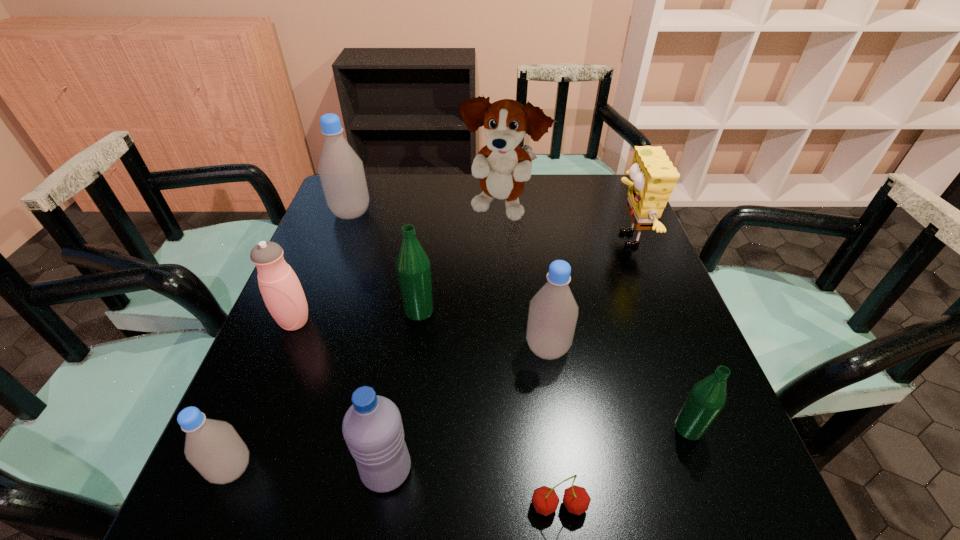
Where is `brown puppy`? The width and height of the screenshot is (960, 540). brown puppy is located at coordinates (502, 165).

This screenshot has width=960, height=540. What are the coordinates of `the farthest bottle` in the screenshot? It's located at (341, 171).

The height and width of the screenshot is (540, 960). I want to click on the farthest gray bottle, so click(341, 171).

Where is `yellow sponge`? Image resolution: width=960 pixels, height=540 pixels. yellow sponge is located at coordinates (652, 180).

At what (x,y) coordinates should I click in order to perform the action: click on the rightmost gray bottle. Please return your answer as a coordinate pair (x, y). The image size is (960, 540). Looking at the image, I should click on tap(553, 312).

The width and height of the screenshot is (960, 540). I want to click on the second farthest gray bottle, so click(x=553, y=312).

At what (x,y) coordinates should I click in order to perform the action: click on the farther green bottle. Please return your answer as a coordinate pair (x, y). Image resolution: width=960 pixels, height=540 pixels. Looking at the image, I should click on (413, 268).

This screenshot has width=960, height=540. In order to click on the left green bottle in this screenshot , I will do `click(413, 268)`.

The image size is (960, 540). I want to click on thermos bottle, so click(x=281, y=290).

At what (x,y) coordinates should I click in order to perform the action: click on water bottle. Please return your answer as a coordinate pair (x, y). Looking at the image, I should click on (372, 427).